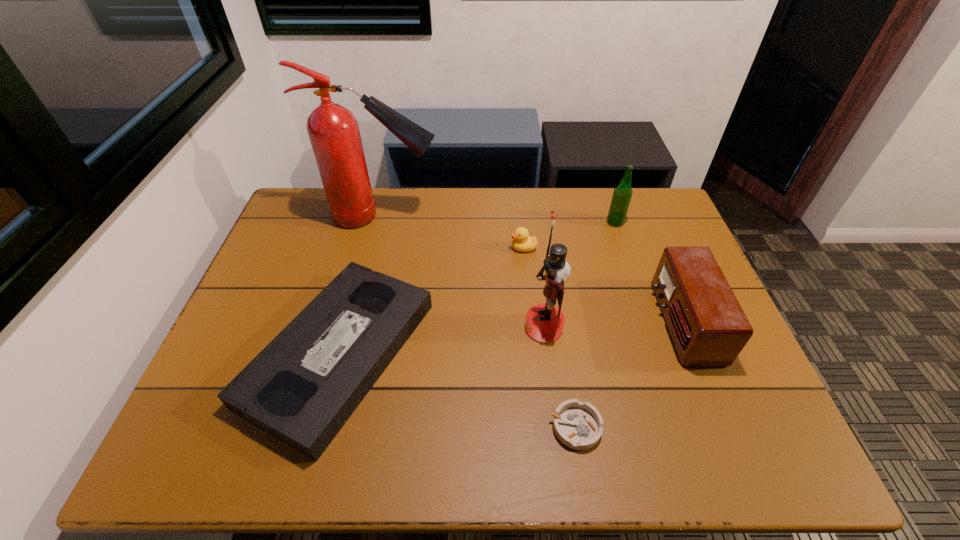
At what (x,y) coordinates should I click in order to perform the action: click on unoccupied position between the sixth shortest object and the shortest object. Please return your answer as a coordinate pair (x, y). Looking at the image, I should click on (560, 377).

I want to click on free space between the fire extinguisher and the sixth shortest object, so click(463, 272).

The height and width of the screenshot is (540, 960). I want to click on vacant space in between the nutcracker and the fourth tallest object, so click(x=613, y=325).

This screenshot has height=540, width=960. I want to click on unoccupied area between the radio receiver and the fifth tallest object, so click(x=604, y=285).

The image size is (960, 540). Identify the location of empty space that is in between the ashtray and the videotape. (458, 390).

In order to click on free space between the third tallest object and the duckling in this screenshot , I will do `click(569, 235)`.

I want to click on vacant region between the fifth nearest object and the fire extinguisher, so click(x=453, y=232).

Locate an element on the screen. This screenshot has width=960, height=540. object that ranks as the closest to the nutcracker is located at coordinates (578, 425).

Find the location of a particular element. The width and height of the screenshot is (960, 540). object identified as the third closest to the sixth shortest object is located at coordinates (302, 388).

You are a GUI agent. You are given a task and a screenshot of the screen. Output one action in this format:
    pyautogui.click(x=<x>, y=<y>)
    Task: Click on the vacant space that satisfies the following two spatial constraints: 1. on the front-facing side of the nutcracker; 2. on the left side of the ashtray
    Image resolution: width=960 pixels, height=540 pixels.
    Given the screenshot: What is the action you would take?
    pyautogui.click(x=556, y=427)